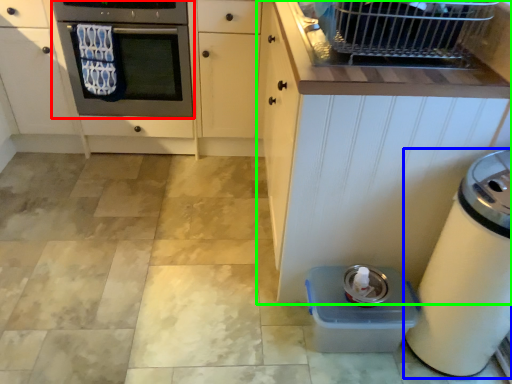
Question: Estimate the real-world distances between objects in this image. Which object is farther from oven (highlighted by a red box), home appliance (highlighted by a blue box) or cabinetry (highlighted by a green box)?

Choices:
 (A) home appliance
 (B) cabinetry

Answer: (A)